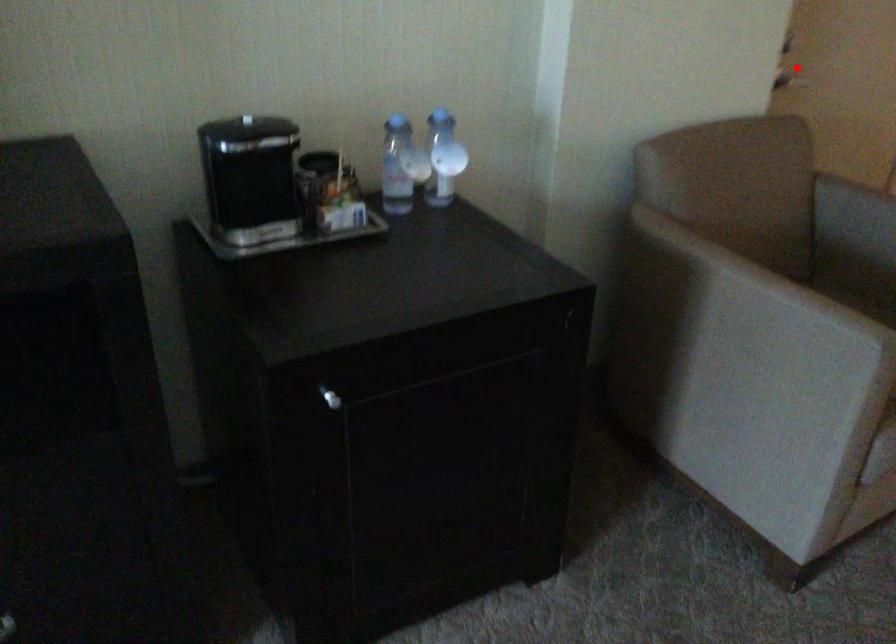
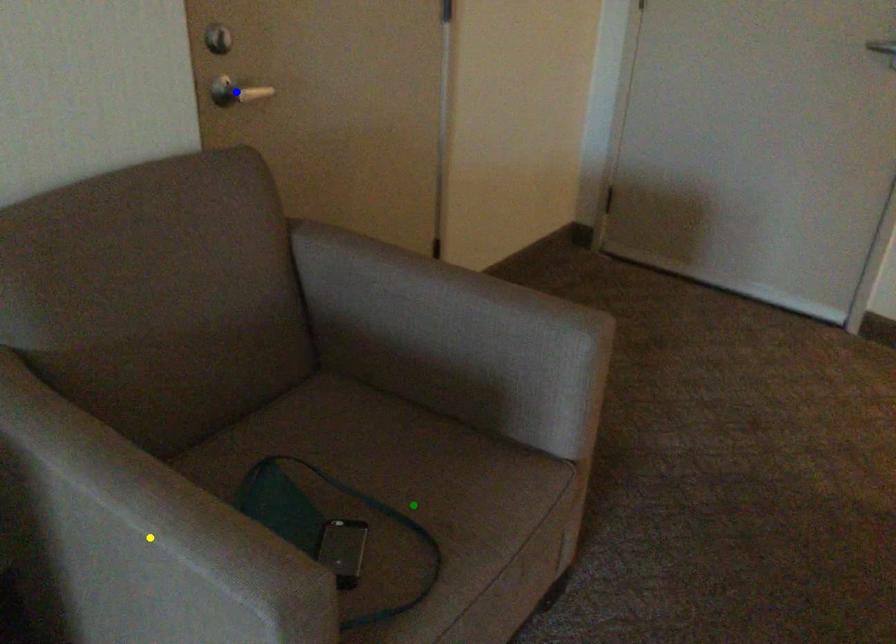
Question: I am providing you with two images of the same scene from different viewpoints. A red point is marked on the first image. You are given multiple points on the second image. Which mark in image 2 goes with the point in image 1?

Choices:
 (A) green point
 (B) blue point
 (C) yellow point

Answer: (B)